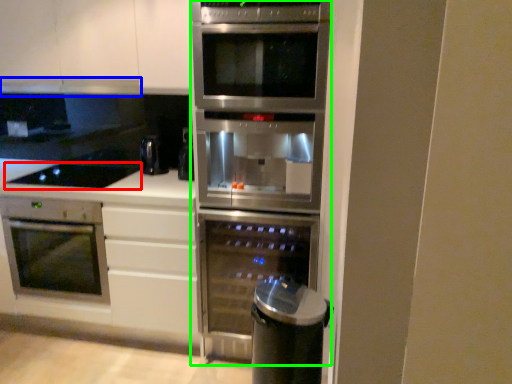
Question: Estimate the real-world distances between objects in this image. Which object is farther from gas stove (highlighted by a red box), exhaust hood (highlighted by a blue box) or fridge (highlighted by a green box)?

Choices:
 (A) exhaust hood
 (B) fridge

Answer: (B)